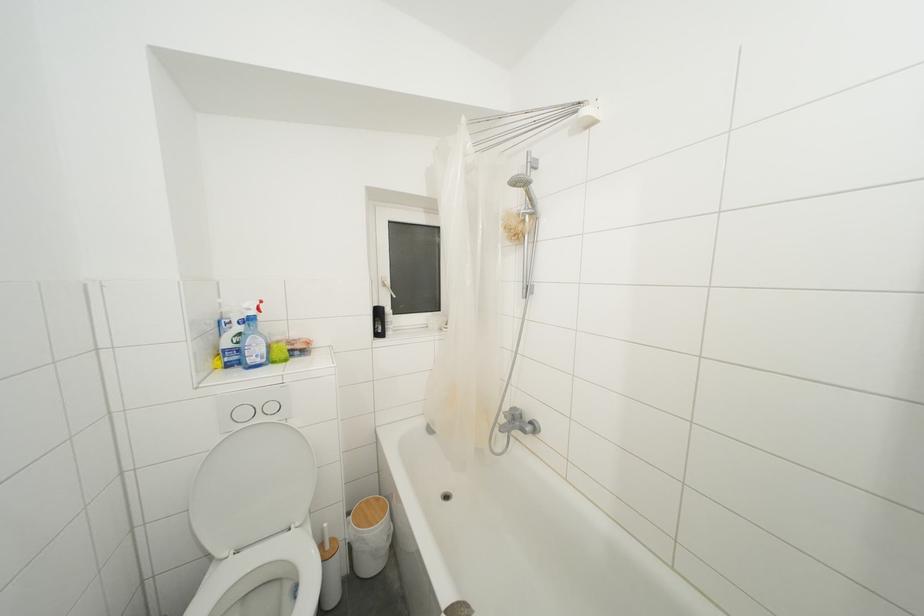
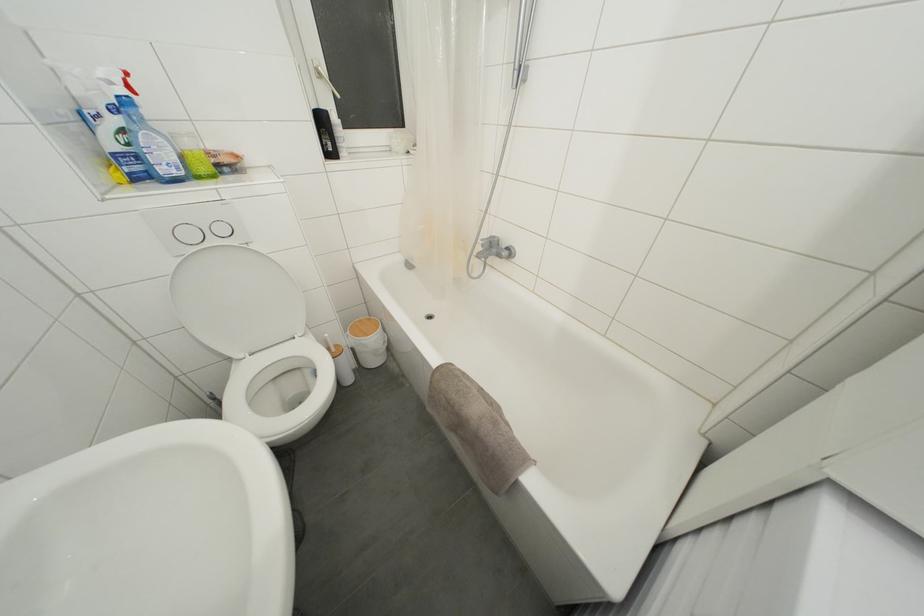
Find the pixel in the second image that matches the point at 283,342 in the first image.

(193, 148)